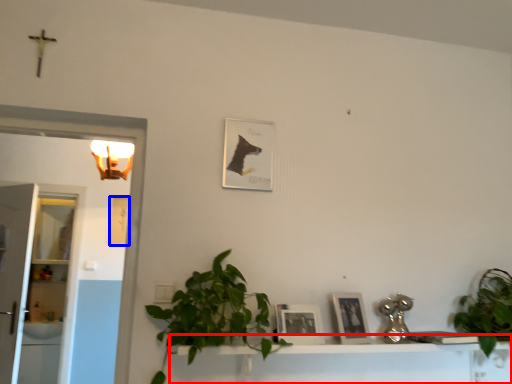
Question: Which point is closer to the camera, vanity (highlighted by a red box) or picture frame (highlighted by a blue box)?

Choices:
 (A) vanity
 (B) picture frame

Answer: (A)